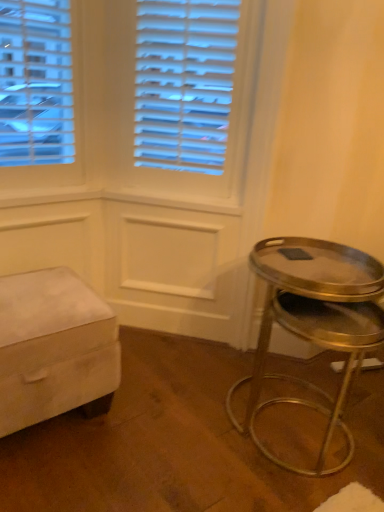
Describe the element at coordinates (314, 321) in the screenshot. This screenshot has height=512, width=384. I see `gold metallic stool at right` at that location.

Measure the distance between gold metallic stool at right and camera.

gold metallic stool at right and camera are 1.24 meters apart.

This screenshot has height=512, width=384. Identify the location of gold metallic stool at right. (314, 321).

Find the location of `velvet beige ottoman at lower left`. velvet beige ottoman at lower left is located at coordinates (54, 349).

The height and width of the screenshot is (512, 384). What do you see at coordinates (54, 349) in the screenshot?
I see `velvet beige ottoman at lower left` at bounding box center [54, 349].

Identify the location of gold metallic stool at right. This screenshot has height=512, width=384. (314, 321).

Considering the relative positions of velvet beige ottoman at lower left and gold metallic stool at right in the image provided, is velvet beige ottoman at lower left to the left or to the right of gold metallic stool at right?

Clearly, velvet beige ottoman at lower left is on the left of gold metallic stool at right in the image.

Does velvet beige ottoman at lower left come in front of gold metallic stool at right?

No.

Is point (100, 355) closer to camera compared to point (321, 454)?

Yes, point (100, 355) is in front of point (321, 454).

From the image's perspective, is velvet beige ottoman at lower left beneath gold metallic stool at right?

Incorrect, from the image's perspective, velvet beige ottoman at lower left is higher than gold metallic stool at right.

Consider the image. From a real-world perspective, which is physically below, velvet beige ottoman at lower left or gold metallic stool at right?

velvet beige ottoman at lower left, from a real-world perspective.

Is velvet beige ottoman at lower left thinner than gold metallic stool at right?

No.

Considering the relative sizes of velvet beige ottoman at lower left and gold metallic stool at right in the image provided, is velvet beige ottoman at lower left shorter than gold metallic stool at right?

Correct, velvet beige ottoman at lower left is not as tall as gold metallic stool at right.

From the picture: Who is bigger, velvet beige ottoman at lower left or gold metallic stool at right?

Bigger between the two is velvet beige ottoman at lower left.

Is gold metallic stool at right a part of velvet beige ottoman at lower left?

No.

Would you consider velvet beige ottoman at lower left to be distant from gold metallic stool at right?

No, velvet beige ottoman at lower left is not far from gold metallic stool at right.

Is velvet beige ottoman at lower left facing away from gold metallic stool at right?

velvet beige ottoman at lower left does not have its back to gold metallic stool at right.

What's the angular difference between velvet beige ottoman at lower left and gold metallic stool at right's facing directions?

The facing directions of velvet beige ottoman at lower left and gold metallic stool at right are 90 degrees apart.

How much distance is there between velvet beige ottoman at lower left and gold metallic stool at right?

They are 27.50 inches apart.

The height and width of the screenshot is (512, 384). I want to click on furniture to the left of gold metallic stool at right, so click(54, 349).

From the picture: Can you confirm if gold metallic stool at right is positioned to the left of velvet beige ottoman at lower left?

Incorrect, gold metallic stool at right is not on the left side of velvet beige ottoman at lower left.

In the scene shown: Which object is further away from the camera taking this photo, gold metallic stool at right or velvet beige ottoman at lower left?

velvet beige ottoman at lower left is further away from the camera.

Considering the points (379, 307) and (59, 361), which point is behind, point (379, 307) or point (59, 361)?

The point (379, 307) is behind.

In the scene shown: From the image's perspective, is gold metallic stool at right below velvet beige ottoman at lower left?

Correct, gold metallic stool at right appears lower than velvet beige ottoman at lower left in the image.

From a real-world perspective, is gold metallic stool at right located higher than velvet beige ottoman at lower left?

Yes, from a real-world perspective, gold metallic stool at right is above velvet beige ottoman at lower left.

Which of these two, gold metallic stool at right or velvet beige ottoman at lower left, is wider?

velvet beige ottoman at lower left is wider.

Is gold metallic stool at right shorter than velvet beige ottoman at lower left?

In fact, gold metallic stool at right may be taller than velvet beige ottoman at lower left.

Based on their sizes in the image, would you say gold metallic stool at right is bigger or smaller than velvet beige ottoman at lower left?

gold metallic stool at right is smaller than velvet beige ottoman at lower left.

Choose the correct answer: Is gold metallic stool at right inside velvet beige ottoman at lower left or outside it?

gold metallic stool at right is not inside velvet beige ottoman at lower left, it's outside.

Is gold metallic stool at right with velvet beige ottoman at lower left?

No, gold metallic stool at right is not next to velvet beige ottoman at lower left.

Does gold metallic stool at right turn towards velvet beige ottoman at lower left?

No, gold metallic stool at right does not turn towards velvet beige ottoman at lower left.

How many degrees apart are the facing directions of gold metallic stool at right and velvet beige ottoman at lower left?

90 degrees separate the facing orientations of gold metallic stool at right and velvet beige ottoman at lower left.

How much distance is there between gold metallic stool at right and velvet beige ottoman at lower left?

27.50 inches.

You are a GUI agent. You are given a task and a screenshot of the screen. Output one action in this format:
    pyautogui.click(x=<x>, y=<y>)
    Task: Click on the stool below the velvet beige ottoman at lower left (from the image's perspective)
    
    Given the screenshot: What is the action you would take?
    pyautogui.click(x=314, y=321)

Find the location of a particular element. Image resolution: width=384 pixels, height=512 pixels. stool below the velvet beige ottoman at lower left (from the image's perspective) is located at coordinates (314, 321).

Find the location of `furniture that is on the left side of gold metallic stool at right`. furniture that is on the left side of gold metallic stool at right is located at coordinates (54, 349).